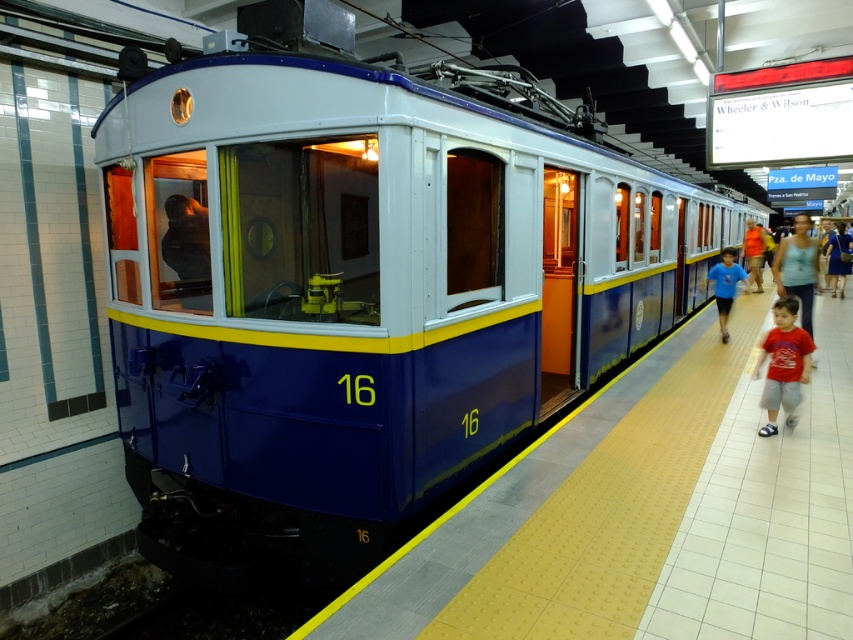
Is point (711, 458) closer to camera compared to point (786, 310)?

Yes.

Based on the photo, does blue glossy platform at center have a smaller size compared to red cotton t-shirt at right?

Incorrect, blue glossy platform at center is not smaller in size than red cotton t-shirt at right.

Identify the location of blue glossy platform at center. The height and width of the screenshot is (640, 853). (646, 513).

Which is in front, point (340, 637) or point (733, 253)?

Point (340, 637)

Which is more to the right, blue glossy platform at center or blue cotton shirt at center?

From the viewer's perspective, blue cotton shirt at center appears more on the right side.

Locate an element on the screen. This screenshot has height=640, width=853. blue glossy platform at center is located at coordinates (646, 513).

Can you confirm if blue dress at right is bigger than orange fabric shirt at right?

Yes, blue dress at right is bigger than orange fabric shirt at right.

Is point (844, 250) positioned before point (751, 250)?

Yes, it is in front of point (751, 250).

At what (x,y) coordinates should I click in order to perform the action: click on blue dress at right. Please return your answer as a coordinate pair (x, y). Looking at the image, I should click on (838, 257).

You are a GUI agent. You are given a task and a screenshot of the screen. Output one action in this format:
    pyautogui.click(x=<x>, y=<y>)
    Task: Click on the blue dress at right
    
    Given the screenshot: What is the action you would take?
    pyautogui.click(x=838, y=257)